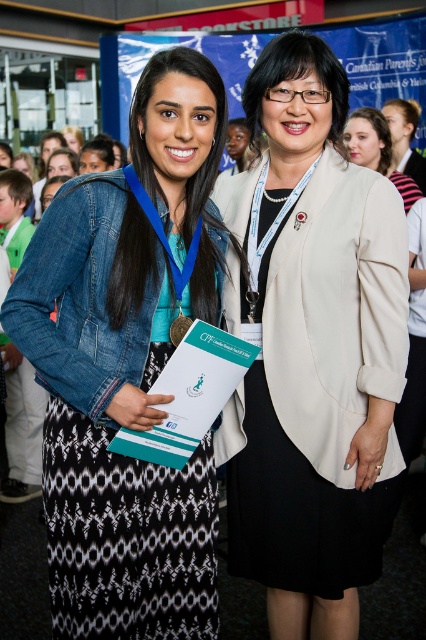
How far apart are denim jacket at left and matte beige blazer at upper center?

They are 5.41 feet apart.

Who is more forward, (218, 147) or (400, 180)?

Positioned in front is point (218, 147).

Is point (158, 422) positioned in front of point (374, 115)?

Yes, it is in front of point (374, 115).

Identify the location of denim jacket at left. (127, 365).

Does beige fabric blazer at center have a lesser height compared to matte beige blazer at upper center?

In fact, beige fabric blazer at center may be taller than matte beige blazer at upper center.

The image size is (426, 640). I want to click on beige fabric blazer at center, so click(311, 349).

Does beige fabric blazer at center have a greater width compared to denim jacket at left?

No, beige fabric blazer at center is not wider than denim jacket at left.

Who is more distant from viewer, (316,212) or (158,484)?

Point (316,212)

This screenshot has height=640, width=426. Identify the location of beige fabric blazer at center. (311, 349).

This screenshot has width=426, height=640. In order to click on beige fabric blazer at center in this screenshot , I will do `click(311, 349)`.